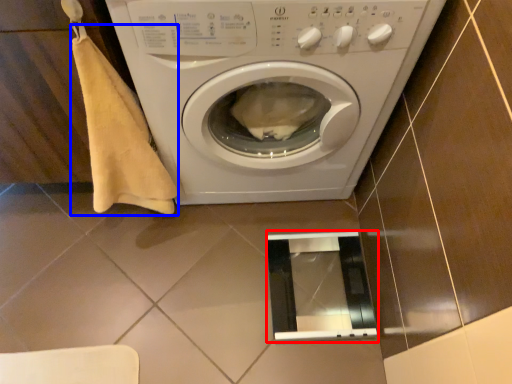
Question: Among these objects, which one is farthest to the camera, screen door (highlighted by a red box) or blanket (highlighted by a blue box)?

Choices:
 (A) screen door
 (B) blanket

Answer: (A)